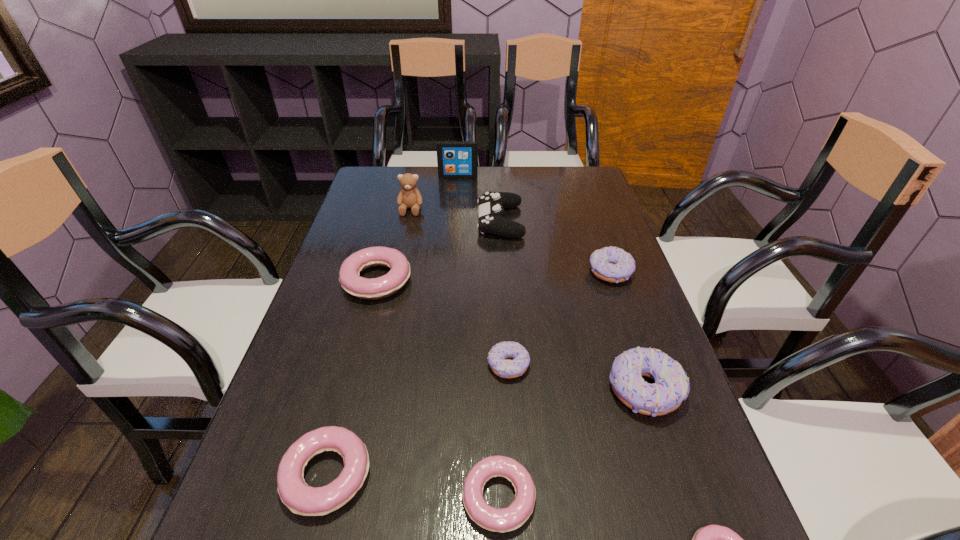
Locate an element on the screen. The height and width of the screenshot is (540, 960). iPod is located at coordinates (456, 159).

Where is `teddy bear`? Image resolution: width=960 pixels, height=540 pixels. teddy bear is located at coordinates (409, 197).

At what (x,y) coordinates should I click in order to perform the action: click on black control. Please return your answer as a coordinate pair (x, y). The image size is (960, 540). Looking at the image, I should click on (491, 205).

This screenshot has height=540, width=960. What are the coordinates of `the tallest doughnut` in the screenshot? It's located at tap(671, 387).

Where is `the farthest pink doughnut`? the farthest pink doughnut is located at coordinates (382, 287).

You are a GUI agent. You are given a task and a screenshot of the screen. Output one action in this format:
    pyautogui.click(x=<x>, y=<y>)
    Task: Click on the farthest brown doughnut
    The height and width of the screenshot is (540, 960).
    Given the screenshot: What is the action you would take?
    pyautogui.click(x=611, y=264)

You are a GUI agent. You are given a task and a screenshot of the screen. Output one action in this format:
    pyautogui.click(x=<x>, y=<y>)
    Task: Click on the third smallest pink doughnut
    
    Given the screenshot: What is the action you would take?
    pyautogui.click(x=298, y=496)

Where is `the smallest brown doughnut`? The width and height of the screenshot is (960, 540). the smallest brown doughnut is located at coordinates (497, 356).

Image resolution: width=960 pixels, height=540 pixels. Find the location of `the third pink doughnut from left to right`. the third pink doughnut from left to right is located at coordinates (507, 519).

The width and height of the screenshot is (960, 540). I want to click on vacant space located on the front screen of the farthest object, so click(457, 190).